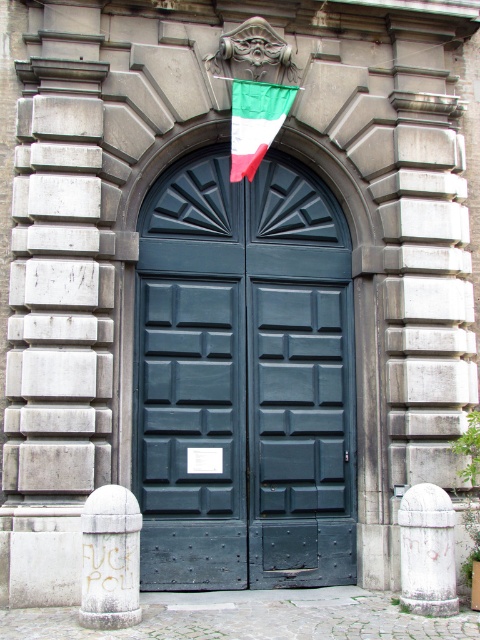
You are a delivery person approaching the entrance door. You need to park your delivery van near the white stone bollard at lower left. However, there is a green fabric flag at center above it. Can you park the van close to the bollard without the flag obstructing the van?

The white stone bollard at lower left is positioned under the green fabric flag at center. Since the flag is above the bollard, parking the van close to the bollard may result in the flag obstructing the van.

You are standing in front of the entrance door and want to place two decorative lights at the coordinates point (240, 476) and point (403, 557). Which light will be closer to you when viewed from your current position?

Point (403, 557) will be closer to you because point (240, 476) is behind it.

You are standing in front of the entrance and want to locate the matte dark green door at center. According to the coordinates provided, where would you look to find it?

The matte dark green door at center is located at point coordinates of [243,380].